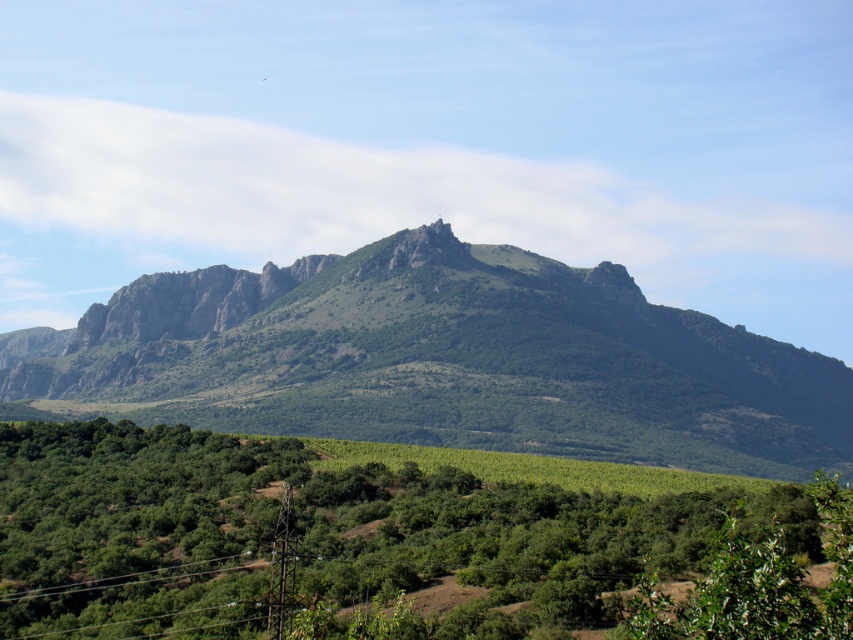
You are an environmental scientist observing the landscape. You need to determine which object occupies more space in the image. Based on the scene, which one is larger in size between the green leafy tree at center and the green textured mountain at center?

The green textured mountain at center is larger in size than the green leafy tree at center.

You are an environmental scientist studying the landscape. You observe the green leafy tree at center and the green textured mountain at center. Which object is closer to you based on the spatial arrangement?

The green leafy tree at center is closer because it is positioned in front of the green textured mountain at center.